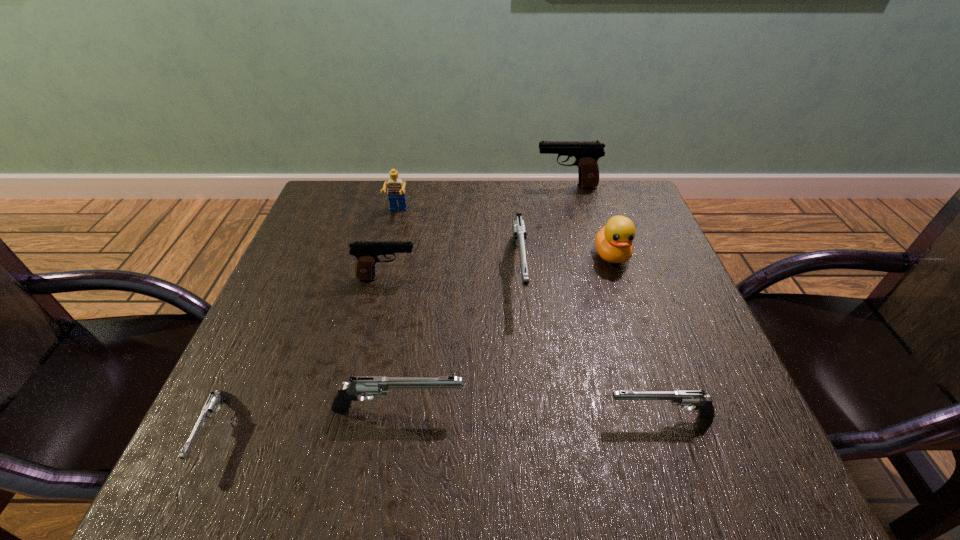
Where is `duckling that is at the right edge`? Image resolution: width=960 pixels, height=540 pixels. duckling that is at the right edge is located at coordinates (613, 242).

I want to click on object that is at the near left corner, so pyautogui.click(x=219, y=397).

Image resolution: width=960 pixels, height=540 pixels. What are the coordinates of `object located in the far right corner section of the desktop` in the screenshot? It's located at (586, 153).

In the image, there is a desktop. In order to click on vacant region at the far edge in this screenshot , I will do `click(431, 202)`.

What are the coordinates of `vacant point at the near edge` in the screenshot? It's located at (343, 450).

The height and width of the screenshot is (540, 960). What are the coordinates of `vacant position at the left edge of the desktop` in the screenshot? It's located at (312, 382).

This screenshot has height=540, width=960. In order to click on free region at the right edge of the desktop in this screenshot , I will do `click(637, 374)`.

In the image, there is a desktop. Identify the location of vacant area at the far left corner. This screenshot has width=960, height=540. (315, 207).

This screenshot has height=540, width=960. In the image, there is a desktop. Identify the location of free space at the near left corner. (264, 469).

Locate an element on the screen. The width and height of the screenshot is (960, 540). vacant space at the far right corner of the desktop is located at coordinates (638, 226).